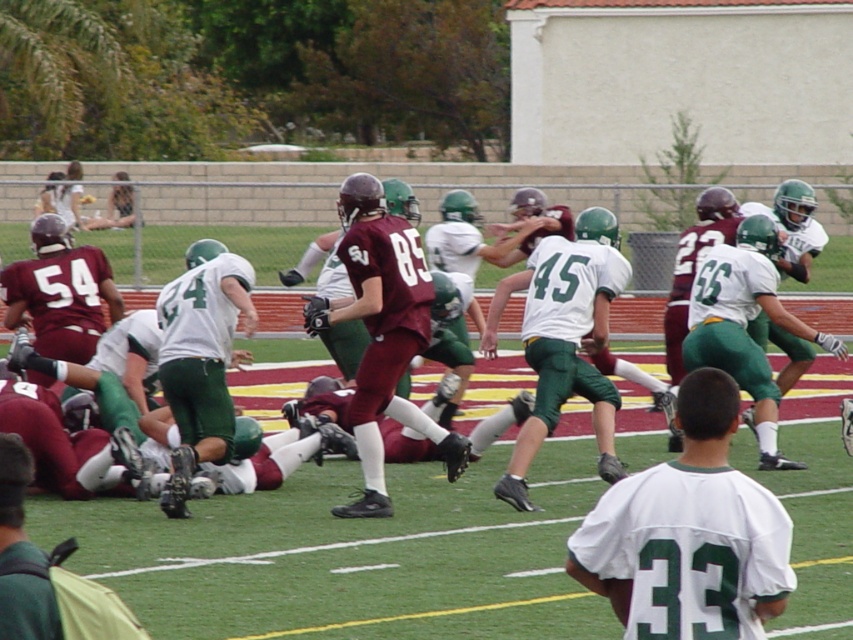
Question: Which object is positioned farthest from the green fabric backpack at lower left?

Choices:
 (A) maroon uniform at center
 (B) maroon jersey at center
 (C) white jersey at center

Answer: (C)

Question: Which point is farther to the camera?

Choices:
 (A) white matte jersey at center
 (B) white/green uniform at center
 (C) white jersey at center
 (D) maroon jersey at center

Answer: (C)

Question: Is maroon jersey at center above white jersey at center?

Choices:
 (A) yes
 (B) no

Answer: (A)

Question: Does maroon jersey at center appear over white jersey at center?

Choices:
 (A) no
 (B) yes

Answer: (B)

Question: Among these points, which one is farthest from the camera?

Choices:
 (A) (199, 436)
 (B) (364, 497)

Answer: (A)

Question: Can you confirm if white matte jersey at center is wider than green fabric backpack at lower left?

Choices:
 (A) no
 (B) yes

Answer: (B)